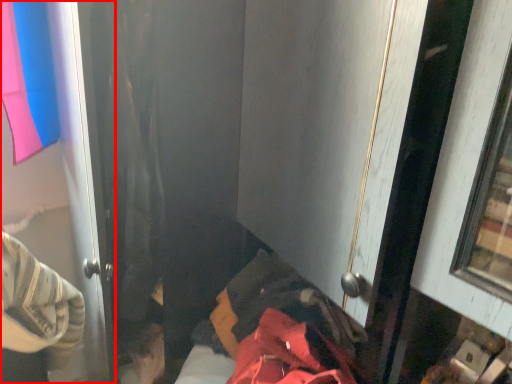
Question: Where is door (annotated by the red box) located in relation to bed in the image?

Choices:
 (A) left
 (B) right

Answer: (A)